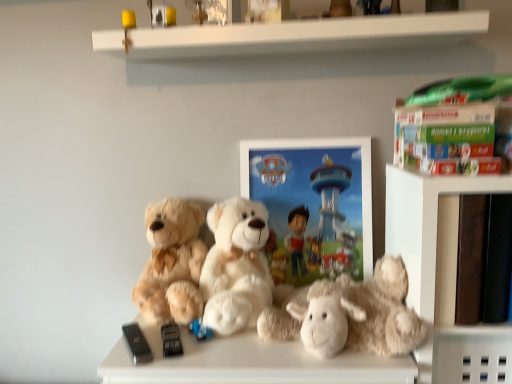
Question: From the image's perspective, is smooth brown bookshelf at right on top of fluffy white teddy bear at center, which appears as the first teddy bear when viewed from the right?

Choices:
 (A) yes
 (B) no

Answer: (A)

Question: Does smooth brown bookshelf at right have a larger size compared to fluffy white teddy bear at center, acting as the third teddy bear starting from the left?

Choices:
 (A) yes
 (B) no

Answer: (A)

Question: Does smooth brown bookshelf at right touch fluffy white teddy bear at center, which appears as the first teddy bear when viewed from the right?

Choices:
 (A) no
 (B) yes

Answer: (A)

Question: Considering the relative sizes of smooth brown bookshelf at right and fluffy white teddy bear at center, which appears as the first teddy bear when viewed from the right, in the image provided, is smooth brown bookshelf at right smaller than fluffy white teddy bear at center, which appears as the first teddy bear when viewed from the right,?

Choices:
 (A) no
 (B) yes

Answer: (A)

Question: From a real-world perspective, is smooth brown bookshelf at right located beneath fluffy white teddy bear at center, which appears as the first teddy bear when viewed from the right?

Choices:
 (A) yes
 (B) no

Answer: (B)

Question: Considering the relative sizes of smooth brown bookshelf at right and fluffy white teddy bear at center, which appears as the first teddy bear when viewed from the right, in the image provided, is smooth brown bookshelf at right wider than fluffy white teddy bear at center, which appears as the first teddy bear when viewed from the right,?

Choices:
 (A) yes
 (B) no

Answer: (B)

Question: Is fuzzy beige teddy bear at left, arranged as the third teddy bear when viewed from the right, smaller than metallic silver toy at upper center, acting as the first toy starting from the top?

Choices:
 (A) no
 (B) yes

Answer: (A)

Question: Does fuzzy beige teddy bear at left, arranged as the third teddy bear when viewed from the right, have a greater height compared to metallic silver toy at upper center, acting as the first toy starting from the top?

Choices:
 (A) yes
 (B) no

Answer: (A)

Question: Is fuzzy beige teddy bear at left, arranged as the third teddy bear when viewed from the right, to the left of metallic silver toy at upper center, acting as the first toy starting from the top, from the viewer's perspective?

Choices:
 (A) no
 (B) yes

Answer: (B)

Question: Is fuzzy beige teddy bear at left, the first teddy bear in the left-to-right sequence, facing away from metallic silver toy at upper center, acting as the first toy starting from the top?

Choices:
 (A) no
 (B) yes

Answer: (A)

Question: Would you say fuzzy beige teddy bear at left, arranged as the third teddy bear when viewed from the right, contains metallic silver toy at upper center, acting as the first toy starting from the top?

Choices:
 (A) no
 (B) yes

Answer: (A)

Question: Can you confirm if fuzzy beige teddy bear at left, arranged as the third teddy bear when viewed from the right, is thinner than metallic silver toy at upper center, which appears as the third toy when ordered from the bottom?

Choices:
 (A) yes
 (B) no

Answer: (B)

Question: Can you confirm if smooth brown bookshelf at right is positioned to the right of white plush teddy bear at center, which appears as the second teddy bear when viewed from the left?

Choices:
 (A) no
 (B) yes

Answer: (B)